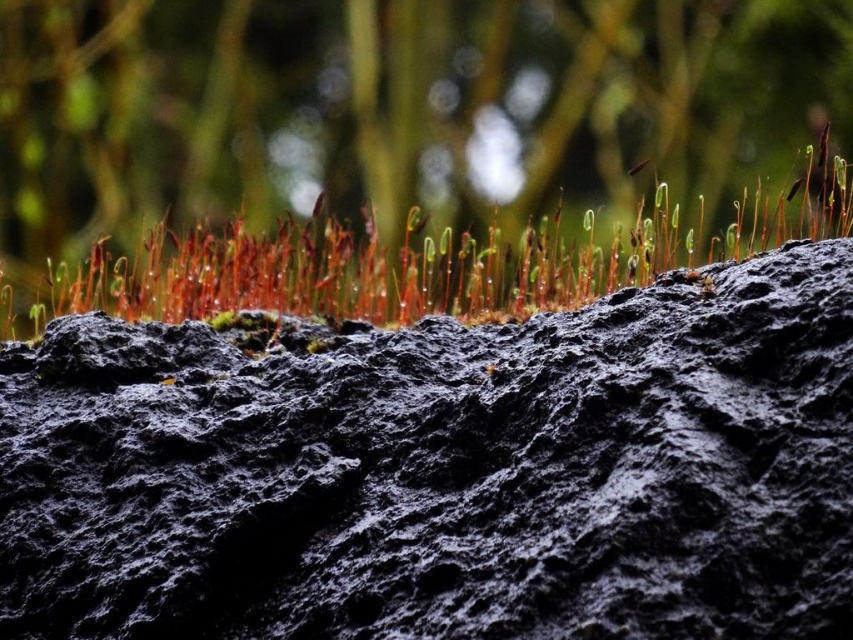
You are a geologist examining the image of a dark, textured surface. You notice a specific point labeled as point (444, 470). Based on the description, what does this point represent?

The point (444, 470) indicates the location of the black rough rock at upper center.

You are standing 10 feet away from a black rough rock at upper center. If you want to get closer to it, how many more feet do you need to move forward?

The black rough rock at upper center is currently 5.08 feet away from you. To get closer, you need to move forward by 10 feet minus 5.08 feet, which equals 4.92 feet.

You are a photographer who wants to capture the black rough rock at upper center and the green matte grass at upper center in the same frame. Based on their sizes in the image, which object would appear larger in the photo?

The black rough rock at upper center appears larger in the photo because it is much taller than the green matte grass at upper center.